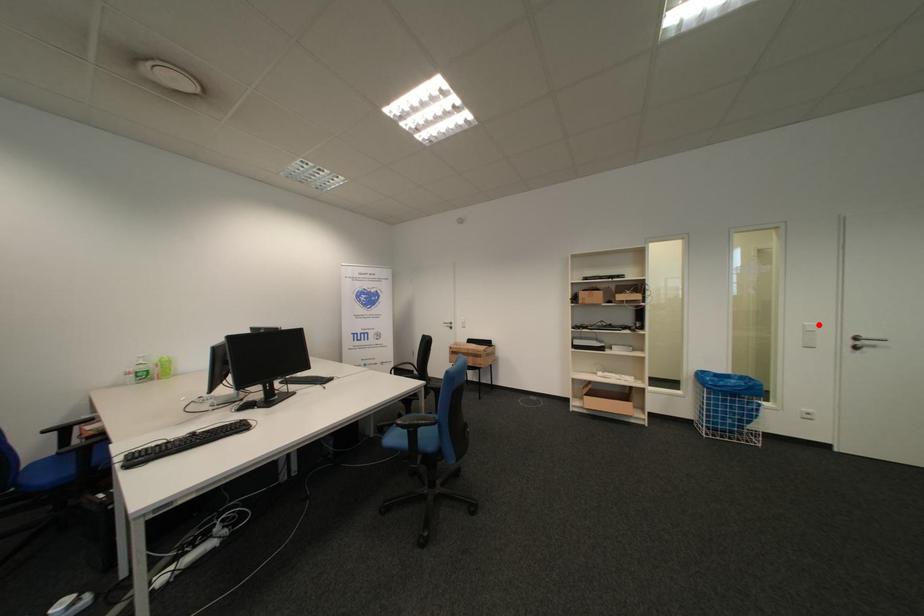
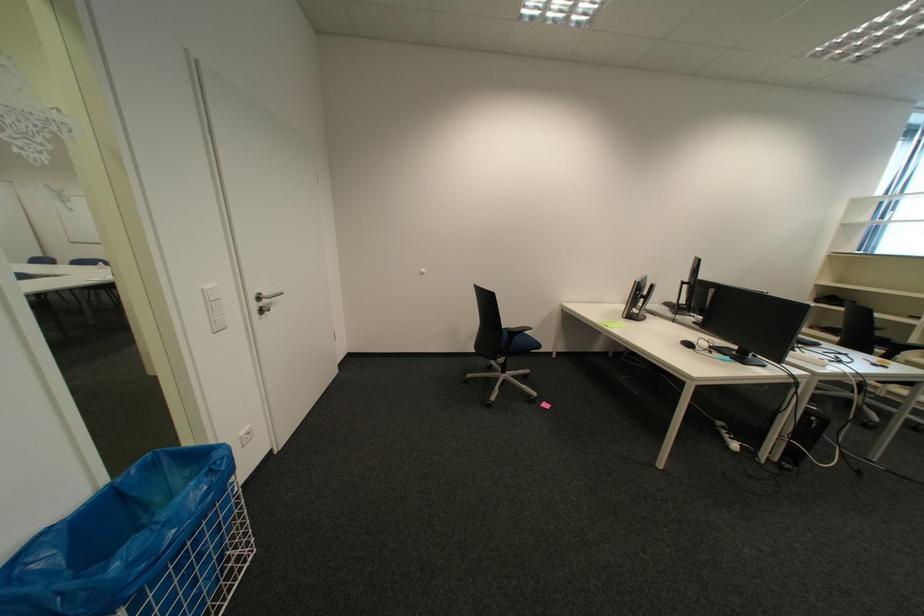
Locate, in the second image, the point that corresponds to the highlighted location in the first image.

(217, 288)